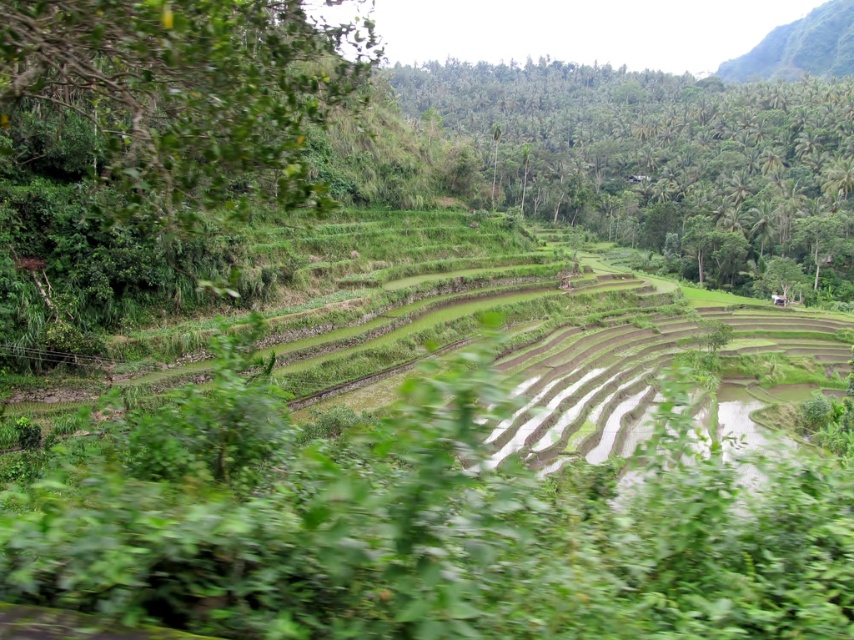
Question: Which point is farther to the camera?

Choices:
 (A) green leafy tree at left
 (B) green leafy hillside at upper right
 (C) green leafy trees at upper center

Answer: (B)

Question: Can you confirm if green leafy trees at upper center is positioned below green leafy tree at left?

Choices:
 (A) no
 (B) yes

Answer: (A)

Question: Does green leafy tree at left have a larger size compared to green leafy hillside at upper right?

Choices:
 (A) no
 (B) yes

Answer: (A)

Question: Is green leafy tree at left positioned behind green leafy hillside at upper right?

Choices:
 (A) yes
 (B) no

Answer: (B)

Question: Which object is farther from the camera taking this photo?

Choices:
 (A) green leafy hillside at upper right
 (B) green leafy trees at upper center
 (C) green leafy tree at left

Answer: (A)

Question: Which object is the farthest from the green leafy trees at upper center?

Choices:
 (A) green leafy hillside at upper right
 (B) green leafy tree at left

Answer: (B)